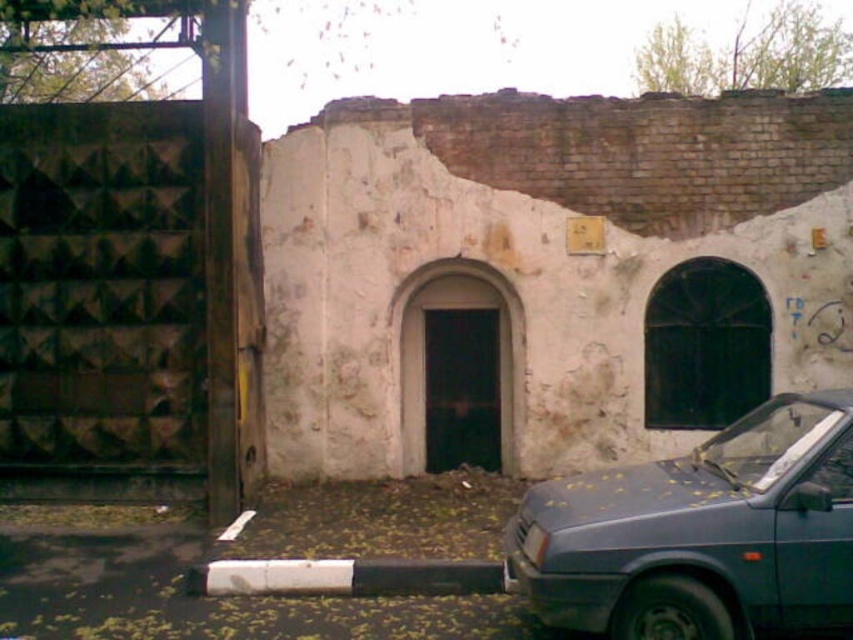
Between matte blue car at lower right and white plastic license plate at center, which one is positioned higher?

matte blue car at lower right

Which is in front, point (553, 545) or point (529, 556)?

Point (553, 545) is in front.

Where is `matte blue car at lower right`? matte blue car at lower right is located at coordinates (703, 532).